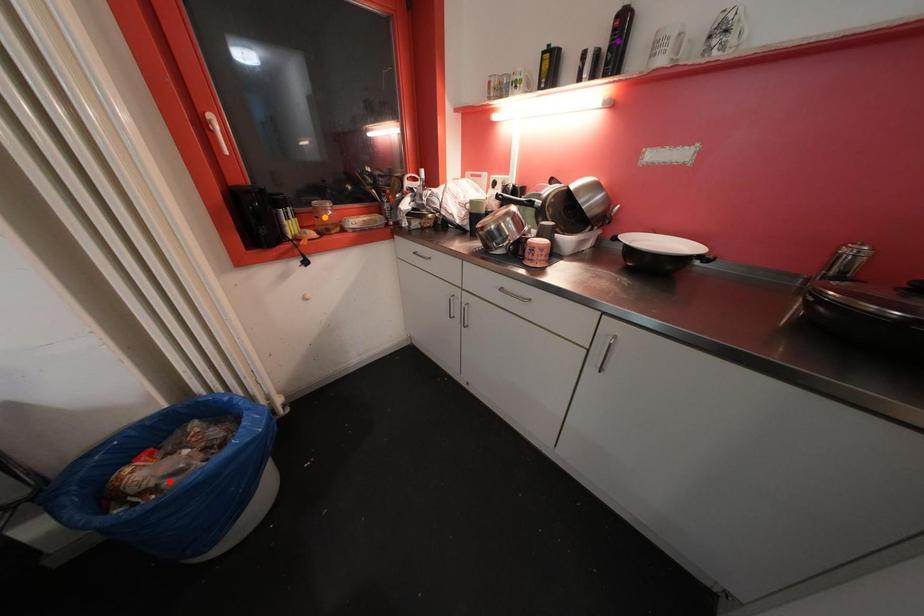
Order these from nearest to farthest:
- orange point
- red point
- purple point

red point < purple point < orange point